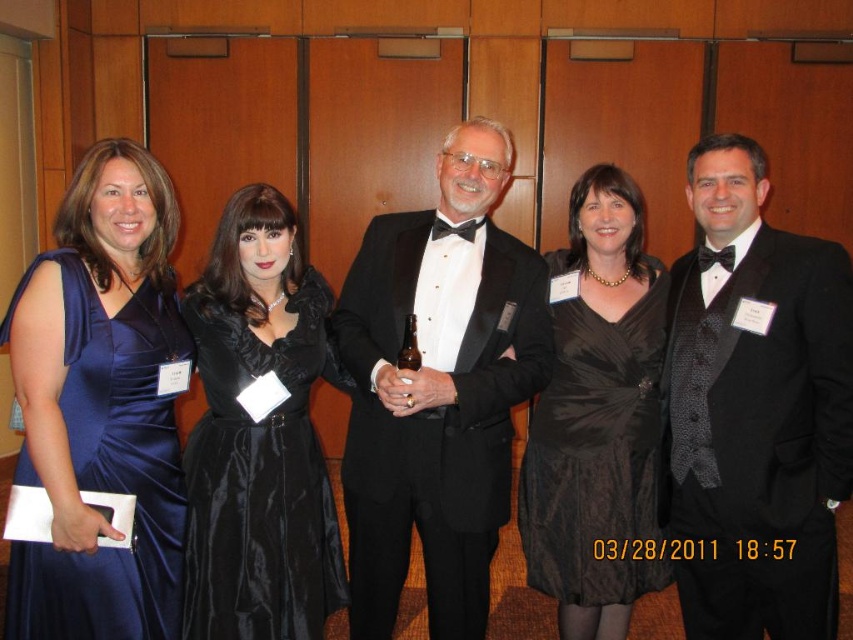
Is black satin suit at center shorter than satin black dress at center?

In fact, black satin suit at center may be taller than satin black dress at center.

Is black satin suit at center wider than satin black dress at center?

No, black satin suit at center is not wider than satin black dress at center.

This screenshot has height=640, width=853. What do you see at coordinates (753, 412) in the screenshot? I see `black satin suit at center` at bounding box center [753, 412].

This screenshot has width=853, height=640. In order to click on black satin suit at center in this screenshot , I will do `click(753, 412)`.

Who is more forward, (717, 417) or (164, 556)?

Point (164, 556) is in front.

Is black satin suit at center below satin blue dress at left?

No, black satin suit at center is not below satin blue dress at left.

The width and height of the screenshot is (853, 640). What are the coordinates of `black satin suit at center` in the screenshot? It's located at (753, 412).

In order to click on black satin suit at center in this screenshot , I will do `click(753, 412)`.

Looking at this image, does satin black dress at center have a larger size compared to black satin dress at center?

Actually, satin black dress at center might be smaller than black satin dress at center.

Is point (254, 483) farther from viewer compared to point (596, 392)?

No.

Locate an element on the screen. The height and width of the screenshot is (640, 853). satin black dress at center is located at coordinates (260, 476).